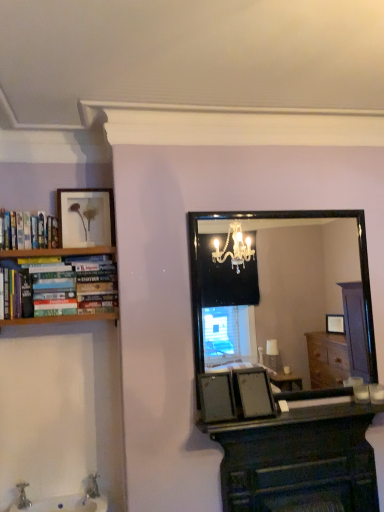
Question: Is the surface of white glossy sink at lower left in direct contact with black glass mirror at center?

Choices:
 (A) yes
 (B) no

Answer: (B)

Question: Considering the relative sizes of white glossy sink at lower left and black glass mirror at center in the image provided, is white glossy sink at lower left smaller than black glass mirror at center?

Choices:
 (A) yes
 (B) no

Answer: (A)

Question: Can you confirm if white glossy sink at lower left is taller than black glass mirror at center?

Choices:
 (A) yes
 (B) no

Answer: (B)

Question: Considering the relative positions of white glossy sink at lower left and black glass mirror at center in the image provided, is white glossy sink at lower left to the right of black glass mirror at center from the viewer's perspective?

Choices:
 (A) no
 (B) yes

Answer: (A)

Question: From the image's perspective, is white glossy sink at lower left located beneath black glass mirror at center?

Choices:
 (A) no
 (B) yes

Answer: (B)

Question: Considering the relative sizes of white glossy sink at lower left and black glass mirror at center in the image provided, is white glossy sink at lower left thinner than black glass mirror at center?

Choices:
 (A) yes
 (B) no

Answer: (B)

Question: Is hardcover books at left behind white glossy sink at lower left?

Choices:
 (A) yes
 (B) no

Answer: (A)

Question: Does hardcover books at left have a lesser height compared to white glossy sink at lower left?

Choices:
 (A) yes
 (B) no

Answer: (B)

Question: From a real-world perspective, does hardcover books at left stand above white glossy sink at lower left?

Choices:
 (A) yes
 (B) no

Answer: (A)

Question: Can you confirm if hardcover books at left is positioned to the right of white glossy sink at lower left?

Choices:
 (A) yes
 (B) no

Answer: (B)

Question: Is hardcover books at left taller than white glossy sink at lower left?

Choices:
 (A) no
 (B) yes

Answer: (B)

Question: Does hardcover books at left have a lesser width compared to white glossy sink at lower left?

Choices:
 (A) yes
 (B) no

Answer: (A)

Question: Considering the relative sizes of matte gold picture frame at upper left and white glossy sink at lower left in the image provided, is matte gold picture frame at upper left smaller than white glossy sink at lower left?

Choices:
 (A) yes
 (B) no

Answer: (A)